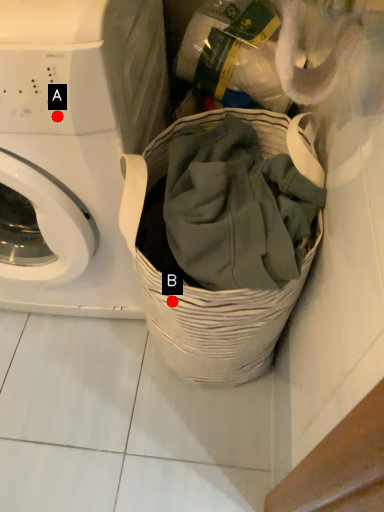
Question: Two points are circled on the image, labeled by A and B beside each circle. Which point is farther to the camera?

Choices:
 (A) A is further
 (B) B is further

Answer: (B)